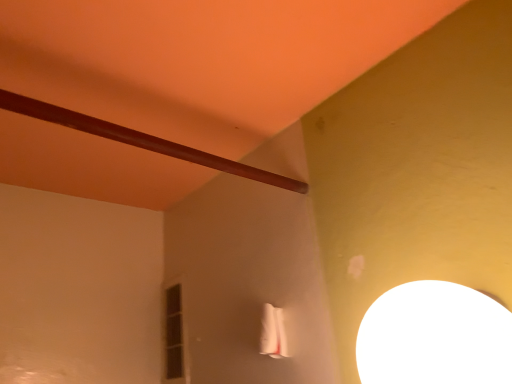
Locate an element on the screen. The image size is (512, 384). white glossy lampshade at upper right is located at coordinates (435, 337).

Can you confirm if matte glass window at center left is positioned to the right of white glossy lampshade at upper right?

No, matte glass window at center left is not to the right of white glossy lampshade at upper right.

From the image's perspective, which object appears higher, matte glass window at center left or white glossy lampshade at upper right?

white glossy lampshade at upper right.

Based on the photo, is the position of matte glass window at center left more distant than that of white glossy lampshade at upper right?

Yes, it is.

Would you say matte glass window at center left is outside white glossy lampshade at upper right?

Yes, matte glass window at center left is not within white glossy lampshade at upper right.

Between brown polished wood beam at upper left and matte glass window at center left, which one has more height?

matte glass window at center left is taller.

Who is bigger, brown polished wood beam at upper left or matte glass window at center left?

matte glass window at center left.

You are a GUI agent. You are given a task and a screenshot of the screen. Output one action in this format:
    pyautogui.click(x=<x>, y=<y>)
    Task: Click on the window below the brown polished wood beam at upper left (from the image's perspective)
    This screenshot has height=384, width=512.
    Given the screenshot: What is the action you would take?
    pyautogui.click(x=174, y=335)

Is matte glass window at center left in front of or behind brown polished wood beam at upper left in the image?

matte glass window at center left is behind brown polished wood beam at upper left.

Considering the relative positions of matte glass window at center left and brown polished wood beam at upper left in the image provided, is matte glass window at center left to the right of brown polished wood beam at upper left from the viewer's perspective?

No, matte glass window at center left is not to the right of brown polished wood beam at upper left.

Is matte glass window at center left positioned with its back to brown polished wood beam at upper left?

No, brown polished wood beam at upper left is not at the back of matte glass window at center left.

Is the surface of matte glass window at center left in direct contact with brown polished wood beam at upper left?

No, matte glass window at center left is not in contact with brown polished wood beam at upper left.

Considering the positions of point (509, 368) and point (181, 375), is point (509, 368) closer or farther from the camera than point (181, 375)?

Point (509, 368) is closer to the camera than point (181, 375).

Would you say white glossy lampshade at upper right is inside or outside matte glass window at center left?

white glossy lampshade at upper right is not enclosed by matte glass window at center left.

Is white glossy lampshade at upper right bigger than matte glass window at center left?

Indeed, white glossy lampshade at upper right has a larger size compared to matte glass window at center left.

In the image, there is a matte glass window at center left. At what (x,y) coordinates should I click in order to perform the action: click on lamp above it (from the image's perspective). Please return your answer as a coordinate pair (x, y). The image size is (512, 384). Looking at the image, I should click on (435, 337).

From the image's perspective, is white glossy lampshade at upper right above or below brown polished wood beam at upper left?

From the image's perspective, white glossy lampshade at upper right appears below brown polished wood beam at upper left.

Can you confirm if white glossy lampshade at upper right is positioned to the left of brown polished wood beam at upper left?

No.

Is white glossy lampshade at upper right beside brown polished wood beam at upper left?

white glossy lampshade at upper right is not next to brown polished wood beam at upper left, and they're not touching.

Is white glossy lampshade at upper right behind brown polished wood beam at upper left?

No, white glossy lampshade at upper right is in front of brown polished wood beam at upper left.

Who is more distant, brown polished wood beam at upper left or white glossy lampshade at upper right?

brown polished wood beam at upper left.

Considering the relative sizes of brown polished wood beam at upper left and white glossy lampshade at upper right in the image provided, is brown polished wood beam at upper left wider than white glossy lampshade at upper right?

Incorrect, the width of brown polished wood beam at upper left does not surpass that of white glossy lampshade at upper right.

Does brown polished wood beam at upper left turn towards white glossy lampshade at upper right?

No.

Who is taller, brown polished wood beam at upper left or white glossy lampshade at upper right?

white glossy lampshade at upper right.

Where is `window lying behind the white glossy lampshade at upper right`? window lying behind the white glossy lampshade at upper right is located at coordinates (174, 335).

Locate an element on the screen. window below the brown polished wood beam at upper left (from a real-world perspective) is located at coordinates [x=174, y=335].

Based on their spatial positions, is matte glass window at center left or brown polished wood beam at upper left closer to white glossy lampshade at upper right?

The object closer to white glossy lampshade at upper right is brown polished wood beam at upper left.

Looking at the image, which one is located further to matte glass window at center left, brown polished wood beam at upper left or white glossy lampshade at upper right?

white glossy lampshade at upper right.

Based on their spatial positions, is brown polished wood beam at upper left or matte glass window at center left further from white glossy lampshade at upper right?

Among the two, matte glass window at center left is located further to white glossy lampshade at upper right.

Looking at the image, which one is located closer to matte glass window at center left, white glossy lampshade at upper right or brown polished wood beam at upper left?

Based on the image, brown polished wood beam at upper left appears to be nearer to matte glass window at center left.

From the picture: Based on their spatial positions, is matte glass window at center left or white glossy lampshade at upper right further from brown polished wood beam at upper left?

Based on the image, matte glass window at center left appears to be further to brown polished wood beam at upper left.

When comparing their distances from brown polished wood beam at upper left, does white glossy lampshade at upper right or matte glass window at center left seem closer?

white glossy lampshade at upper right.

The image size is (512, 384). Identify the location of beam located between white glossy lampshade at upper right and matte glass window at center left in the depth direction. (141, 140).